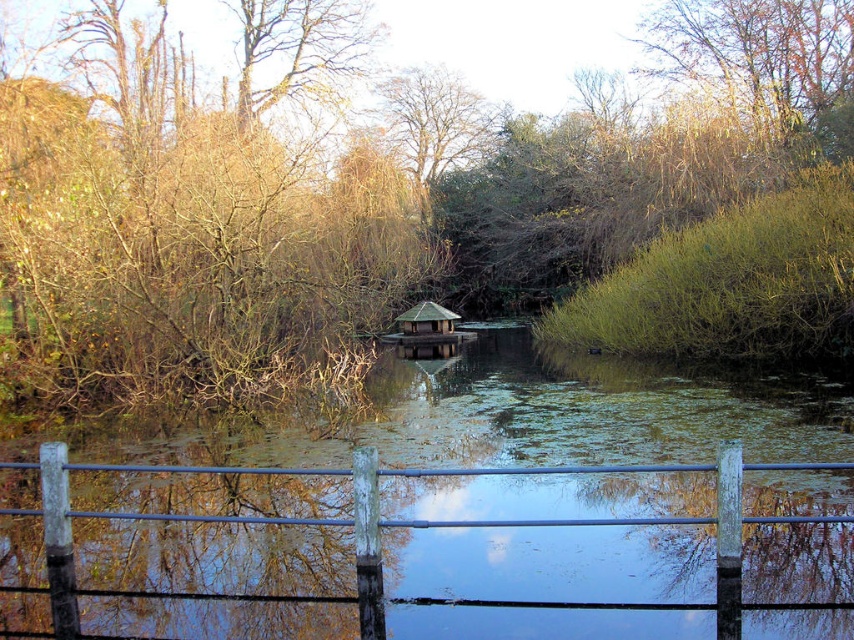
Who is positioned more to the left, wooden fence at center or brown leafy tree at upper center?

From the viewer's perspective, wooden fence at center appears more on the left side.

Is wooden fence at center to the left of brown leafy tree at upper center from the viewer's perspective?

Yes, wooden fence at center is to the left of brown leafy tree at upper center.

Describe the element at coordinates (402, 522) in the screenshot. I see `wooden fence at center` at that location.

This screenshot has height=640, width=854. Find the location of `wooden fence at center`. wooden fence at center is located at coordinates (402, 522).

Can you confirm if brown leafless tree at center is thinner than brown leafy tree at upper center?

Incorrect, brown leafless tree at center's width is not less than brown leafy tree at upper center's.

Is point (687, 120) behind point (776, 42)?

No.

What are the coordinates of `brown leafless tree at center` in the screenshot? It's located at (385, 195).

In order to click on brown leafless tree at center in this screenshot , I will do `click(385, 195)`.

Consider the image. Who is higher up, brown leafless tree at center or wooden fence at center?

brown leafless tree at center is higher up.

This screenshot has width=854, height=640. What do you see at coordinates (385, 195) in the screenshot?
I see `brown leafless tree at center` at bounding box center [385, 195].

The height and width of the screenshot is (640, 854). Identify the location of brown leafless tree at center. (385, 195).